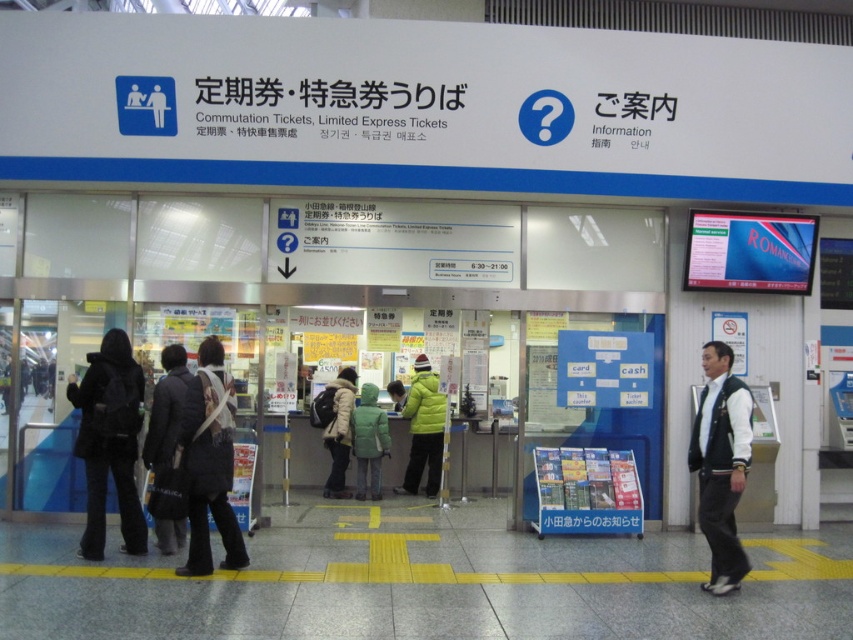
You are standing at the entrance of the train station counter area. You need to locate the dark gray fabric coat at lower left. Where exactly is it positioned in terms of coordinates?

The dark gray fabric coat at lower left is positioned at coordinates point [166,410].